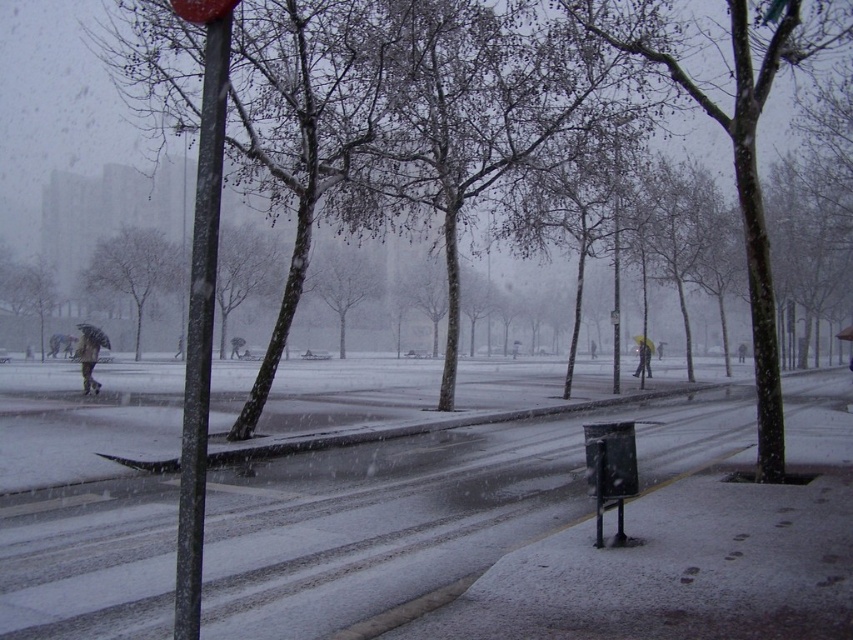
You are standing at the center of the road in this snowy scene. You want to locate the metallic pole at left. Based on its coordinates, in which direction should you look to find it?

The metallic pole at left is located at coordinates point (200, 307), which is to the left side of the scene. Since you are standing at the center of the road, you should look to your left to find the metallic pole at left.

You are a pedestrian trying to reach the metallic bus stop at lower right. You are currently standing next to the smooth gray tree at center. Which direction should you move to get to the bus stop?

The smooth gray tree at center is positioned over the metallic bus stop at lower right, so you should move downward or to the lower part of the scene to reach the metallic bus stop at lower right.

You are a delivery person trying to decide whether to park your vehicle between the smooth gray tree at center and the metallic bus stop at lower right. Given that your vehicle is 2 meters wide, can you fit it there?

The smooth gray tree at center is taller than the metallic bus stop at lower right, but the question is about width. Since the description only mentions height, there is no information provided about the distance between them. Therefore, it is impossible to determine if the vehicle can fit.